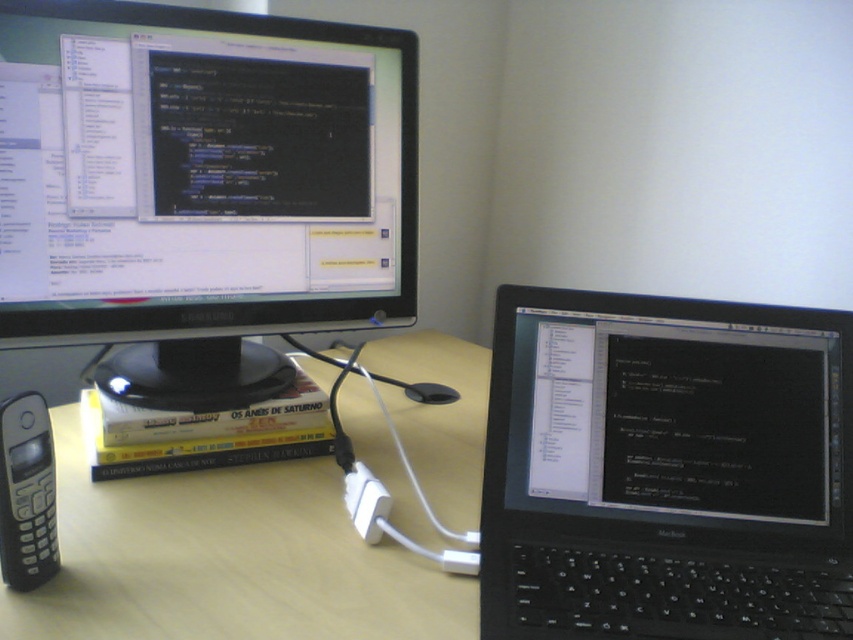
Question: Among these objects, which one is farthest from the camera?

Choices:
 (A) black plastic phone at left
 (B) light brown wood computer desk at center
 (C) matte black monitor at upper left

Answer: (C)

Question: Which of the following is the closest to the observer?

Choices:
 (A) (258, 115)
 (B) (677, 579)
 (C) (49, 476)
 (D) (465, 356)

Answer: (C)

Question: Considering the relative positions of black plastic laptop at center and light brown wood computer desk at center in the image provided, where is black plastic laptop at center located with respect to light brown wood computer desk at center?

Choices:
 (A) above
 (B) below

Answer: (A)

Question: Does matte black monitor at upper left have a lesser width compared to black plastic phone at left?

Choices:
 (A) yes
 (B) no

Answer: (B)

Question: Among these objects, which one is nearest to the camera?

Choices:
 (A) light brown wood computer desk at center
 (B) black plastic laptop at center
 (C) matte black monitor at upper left
 (D) black plastic phone at left

Answer: (A)

Question: Is matte black monitor at upper left below black plastic phone at left?

Choices:
 (A) no
 (B) yes

Answer: (A)